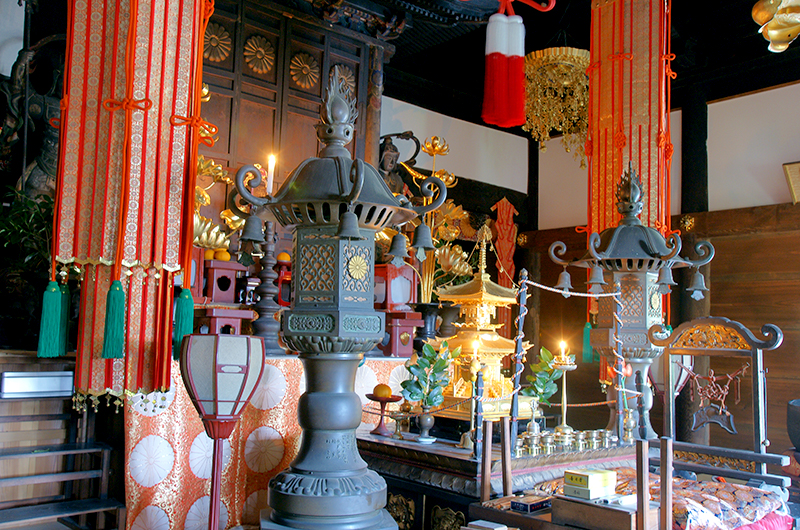
Image resolution: width=800 pixels, height=530 pixels. I want to click on art, so click(142, 161), click(616, 148).